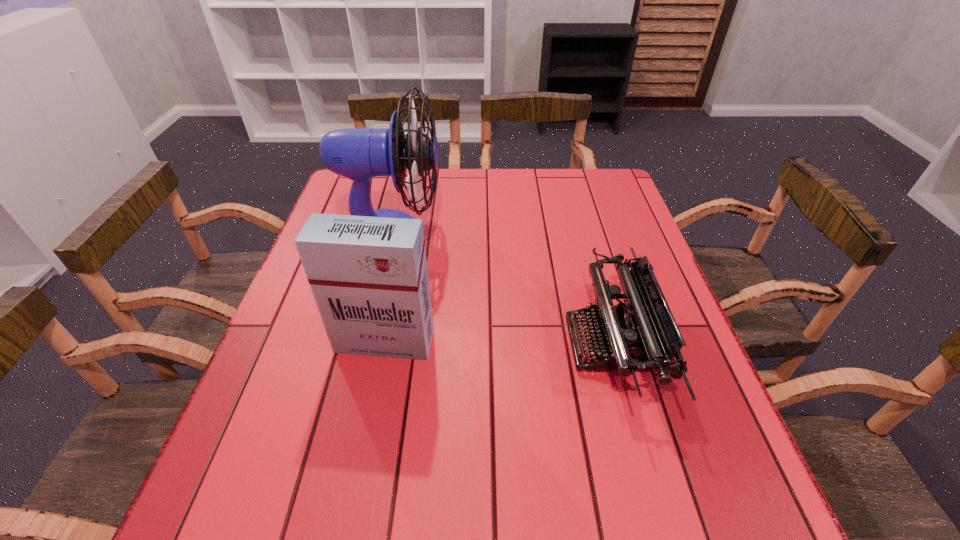
Locate an element on the screen. object that is the second closest to the typewriter is located at coordinates (359, 154).

This screenshot has height=540, width=960. Find the location of `object that is the closest to the farthest object`. object that is the closest to the farthest object is located at coordinates (368, 275).

The height and width of the screenshot is (540, 960). I want to click on free spot that satisfies the following two spatial constraints: 1. in front of the tallest object where the airflow is directed; 2. on the left side of the second tallest object, so click(x=365, y=342).

The height and width of the screenshot is (540, 960). I want to click on free point that satisfies the following two spatial constraints: 1. in front of the cigarette case where the airflow is directed; 2. on the right side of the fan, so click(365, 342).

Identify the location of vacant region that satisfies the following two spatial constraints: 1. in front of the cigarette case where the airflow is directed; 2. on the left side of the fan. This screenshot has width=960, height=540. (365, 342).

You are a GUI agent. You are given a task and a screenshot of the screen. Output one action in this format:
    pyautogui.click(x=<x>, y=<y>)
    Task: Click on the free space in the image that satisfies the following two spatial constraints: 1. in front of the second shortest object where the airflow is directed; 2. on the left side of the farthest object
    
    Given the screenshot: What is the action you would take?
    coord(365,342)